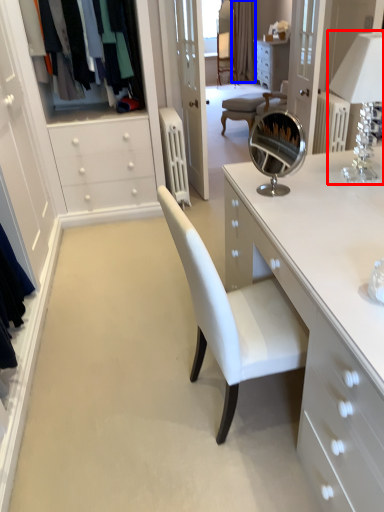
Question: Which point is further to the camera, table lamp (highlighted by a red box) or curtain (highlighted by a blue box)?

Choices:
 (A) table lamp
 (B) curtain

Answer: (B)